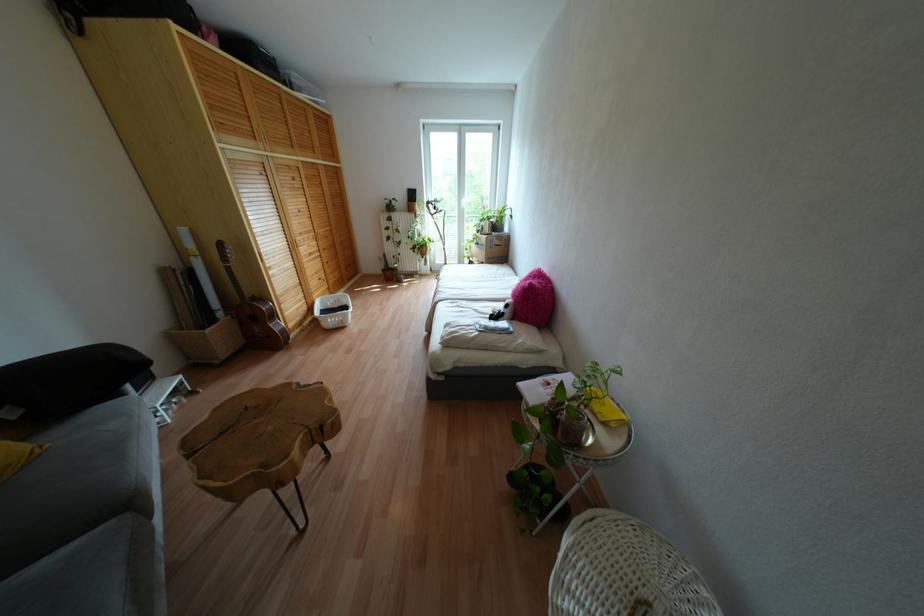
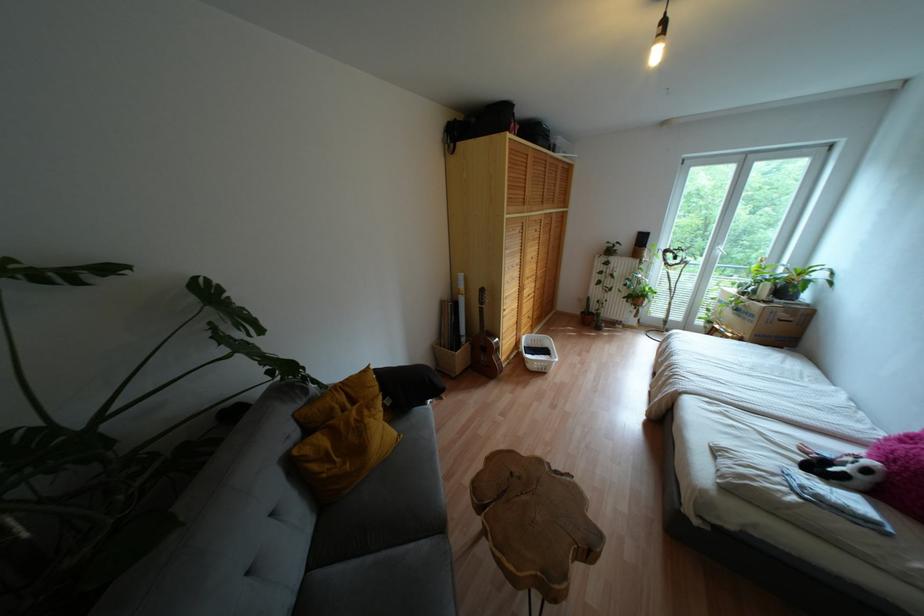
Question: The camera is either moving clockwise (left) or counter-clockwise (right) around the object. The first image is from the beginning of the video and the second image is from the end. Is the camera moving left or right when shooting the video?

Choices:
 (A) Left
 (B) Right

Answer: (B)